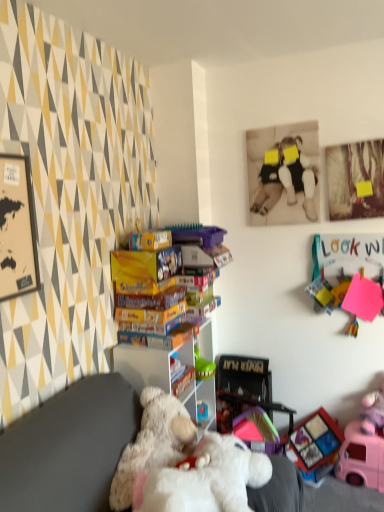
What do you see at coordinates (169, 370) in the screenshot?
I see `white plastic shelf at center` at bounding box center [169, 370].

This screenshot has height=512, width=384. Describe the element at coordinates (372, 412) in the screenshot. I see `pink fabric doll at lower right, arranged as the 3th toy when ordered from the bottom` at that location.

This screenshot has width=384, height=512. Describe the element at coordinates (348, 275) in the screenshot. I see `pink felt sign at upper right, which ranks as the 1th toy in top-to-bottom order` at that location.

This screenshot has width=384, height=512. Describe the element at coordinates (284, 174) in the screenshot. I see `sepia-toned photograph at upper center` at that location.

What do you see at coordinates (69, 447) in the screenshot?
I see `white plush bear at center` at bounding box center [69, 447].

The width and height of the screenshot is (384, 512). What do you see at coordinates (361, 458) in the screenshot?
I see `pink plastic toy car at lower right, the first toy ordered from the bottom` at bounding box center [361, 458].

What is the approximate width of pink plastic toy car at lower right, marked as the fourth toy in a top-to-bottom arrangement?

pink plastic toy car at lower right, marked as the fourth toy in a top-to-bottom arrangement, is 10.11 inches wide.

The width and height of the screenshot is (384, 512). In order to click on white plastic shelf at center in this screenshot , I will do `click(169, 370)`.

Consider the image. From the image's perspective, which is below, white plastic shelf at center or pink plastic toy car at lower right, marked as the fourth toy in a top-to-bottom arrangement?

pink plastic toy car at lower right, marked as the fourth toy in a top-to-bottom arrangement, is shown below in the image.

Can you confirm if white plastic shelf at center is taller than pink plastic toy car at lower right, the first toy ordered from the bottom?

Yes, white plastic shelf at center is taller than pink plastic toy car at lower right, the first toy ordered from the bottom.

Consider the image. Is white plastic shelf at center further to the viewer compared to pink plastic toy car at lower right, the first toy ordered from the bottom?

No, white plastic shelf at center is closer to the camera.

Which object is closer to the camera, white plastic shelf at center or pink fabric doll at lower right, arranged as the 3th toy when ordered from the bottom?

white plastic shelf at center is closer to the camera.

In the scene shown: Would you say white plastic shelf at center is to the left or to the right of pink fabric doll at lower right, arranged as the second toy when viewed from the top, in the picture?

white plastic shelf at center is positioned on pink fabric doll at lower right, arranged as the second toy when viewed from the top,'s left side.

Is white plastic shelf at center far from pink fabric doll at lower right, arranged as the 3th toy when ordered from the bottom?

Yes, white plastic shelf at center and pink fabric doll at lower right, arranged as the 3th toy when ordered from the bottom, are located far from each other.

Between point (207, 390) and point (366, 399), which one is positioned behind?

The point (207, 390) is behind.

Which object is thinner, pink plastic toy car at lower right, marked as the fourth toy in a top-to-bottom arrangement, or white plastic shelf at center?

pink plastic toy car at lower right, marked as the fourth toy in a top-to-bottom arrangement.

From the picture: Considering the sizes of objects pink plastic toy car at lower right, the first toy ordered from the bottom, and white plastic shelf at center in the image provided, who is taller, pink plastic toy car at lower right, the first toy ordered from the bottom, or white plastic shelf at center?

white plastic shelf at center is taller.

Is pink plastic toy car at lower right, the first toy ordered from the bottom, not within white plastic shelf at center?

Yes, pink plastic toy car at lower right, the first toy ordered from the bottom, is located beyond the bounds of white plastic shelf at center.

Is pink fabric doll at lower right, arranged as the second toy when viewed from the top, spatially inside pink felt sign at upper right, which ranks as the 1th toy in top-to-bottom order, or outside of it?

pink fabric doll at lower right, arranged as the second toy when viewed from the top, is spatially situated outside pink felt sign at upper right, which ranks as the 1th toy in top-to-bottom order.

Between pink fabric doll at lower right, arranged as the second toy when viewed from the top, and pink felt sign at upper right, which ranks as the 1th toy in top-to-bottom order, which one has smaller size?

pink felt sign at upper right, which ranks as the 1th toy in top-to-bottom order, is smaller.

Can you confirm if pink fabric doll at lower right, arranged as the 3th toy when ordered from the bottom, is taller than pink felt sign at upper right, the fourth toy from the bottom?

In fact, pink fabric doll at lower right, arranged as the 3th toy when ordered from the bottom, may be shorter than pink felt sign at upper right, the fourth toy from the bottom.

Looking at their sizes, would you say pink fabric doll at lower right, arranged as the second toy when viewed from the top, is wider or thinner than pink felt sign at upper right, which ranks as the 1th toy in top-to-bottom order?

In the image, pink fabric doll at lower right, arranged as the second toy when viewed from the top, appears to be wider than pink felt sign at upper right, which ranks as the 1th toy in top-to-bottom order.

Looking at this image, considering the relative sizes of white plush bear at center and pink fabric doll at lower right, arranged as the second toy when viewed from the top, in the image provided, is white plush bear at center bigger than pink fabric doll at lower right, arranged as the second toy when viewed from the top,?

Yes.

Can you confirm if white plush bear at center is positioned to the left of pink fabric doll at lower right, arranged as the second toy when viewed from the top?

Correct, you'll find white plush bear at center to the left of pink fabric doll at lower right, arranged as the second toy when viewed from the top.

Find the location of a particular element. The image size is (384, 512). furniture lying below the pink fabric doll at lower right, arranged as the second toy when viewed from the top (from the image's perspective) is located at coordinates (69, 447).

Does matte plastic toy at lower right, which ranks as the second toy in bottom-to-top order, touch sepia-toned photograph at upper center?

matte plastic toy at lower right, which ranks as the second toy in bottom-to-top order, and sepia-toned photograph at upper center are clearly separated.

From the image's perspective, would you say matte plastic toy at lower right, positioned as the third toy in top-to-bottom order, is shown under sepia-toned photograph at upper center?

Yes.

Locate an element on the screen. The width and height of the screenshot is (384, 512). picture frame in front of the matte plastic toy at lower right, which ranks as the second toy in bottom-to-top order is located at coordinates (284, 174).

Which object is positioned more to the right, matte plastic toy at lower right, positioned as the third toy in top-to-bottom order, or sepia-toned photograph at upper center?

matte plastic toy at lower right, positioned as the third toy in top-to-bottom order, is more to the right.

Can you tell me how much sepia-toned photograph at upper center and white plush bear at center differ in facing direction?

The angle between the facing direction of sepia-toned photograph at upper center and the facing direction of white plush bear at center is 89.2 degrees.

Which is behind, sepia-toned photograph at upper center or white plush bear at center?

sepia-toned photograph at upper center is further from the camera.

Is sepia-toned photograph at upper center facing towards white plush bear at center?

No, sepia-toned photograph at upper center is not facing towards white plush bear at center.

From a real-world perspective, who is located higher, sepia-toned photograph at upper center or white plush bear at center?

sepia-toned photograph at upper center, from a real-world perspective.

What are the coordinates of `shelf above the pink plastic toy car at lower right, marked as the fourth toy in a top-to-bottom arrangement (from the image's perspective)` in the screenshot? It's located at (169, 370).

Identify the location of toy that is the 1st one below the white plastic shelf at center (from a real-world perspective). (372, 412).

Which object lies nearer to the anchor point pink fabric doll at lower right, arranged as the second toy when viewed from the top, pink plastic toy car at lower right, marked as the fourth toy in a top-to-bottom arrangement, or matte plastic toy at lower right, which ranks as the second toy in bottom-to-top order?

Based on the image, pink plastic toy car at lower right, marked as the fourth toy in a top-to-bottom arrangement, appears to be nearer to pink fabric doll at lower right, arranged as the second toy when viewed from the top.

Estimate the real-world distances between objects in this image. Which object is closer to pink plastic toy car at lower right, marked as the fourth toy in a top-to-bottom arrangement, pink felt sign at upper right, the fourth toy from the bottom, or white plush bear at center?

pink felt sign at upper right, the fourth toy from the bottom.

When comparing their distances from pink felt sign at upper right, the fourth toy from the bottom, does white plastic shelf at center or pink plastic toy car at lower right, the first toy ordered from the bottom, seem further?

Based on the image, white plastic shelf at center appears to be further to pink felt sign at upper right, the fourth toy from the bottom.

When comparing their distances from white plastic shelf at center, does pink fabric doll at lower right, arranged as the 3th toy when ordered from the bottom, or sepia-toned photograph at upper center seem closer?

Based on the image, sepia-toned photograph at upper center appears to be nearer to white plastic shelf at center.

Considering their positions, is pink fabric doll at lower right, arranged as the 3th toy when ordered from the bottom, positioned closer to pink felt sign at upper right, the fourth toy from the bottom, than white plastic shelf at center?

pink fabric doll at lower right, arranged as the 3th toy when ordered from the bottom, is positioned closer to the anchor pink felt sign at upper right, the fourth toy from the bottom.

Based on their spatial positions, is white plastic shelf at center or white plush bear at center further from matte plastic toy at lower right, which ranks as the second toy in bottom-to-top order?

white plush bear at center.

From the picture: When comparing their distances from pink fabric doll at lower right, arranged as the 3th toy when ordered from the bottom, does matte plastic toy at lower right, positioned as the third toy in top-to-bottom order, or white plush bear at center seem closer?

The object closer to pink fabric doll at lower right, arranged as the 3th toy when ordered from the bottom, is matte plastic toy at lower right, positioned as the third toy in top-to-bottom order.

Based on their spatial positions, is pink fabric doll at lower right, arranged as the 3th toy when ordered from the bottom, or pink felt sign at upper right, the fourth toy from the bottom, further from white plastic shelf at center?

pink fabric doll at lower right, arranged as the 3th toy when ordered from the bottom, is further to white plastic shelf at center.

The width and height of the screenshot is (384, 512). Find the location of `shelf between sepia-toned photograph at upper center and pink fabric doll at lower right, arranged as the 3th toy when ordered from the bottom, in the vertical direction`. shelf between sepia-toned photograph at upper center and pink fabric doll at lower right, arranged as the 3th toy when ordered from the bottom, in the vertical direction is located at coordinates pos(169,370).

I want to click on shelf positioned between white plush bear at center and pink felt sign at upper right, the fourth toy from the bottom, from near to far, so click(169, 370).

Locate an element on the screen. The image size is (384, 512). shelf between white plush bear at center and matte plastic toy at lower right, positioned as the third toy in top-to-bottom order, in the front-back direction is located at coordinates (169, 370).

The width and height of the screenshot is (384, 512). In order to click on picture frame between white plush bear at center and matte plastic toy at lower right, positioned as the third toy in top-to-bottom order, along the z-axis in this screenshot , I will do `click(284, 174)`.